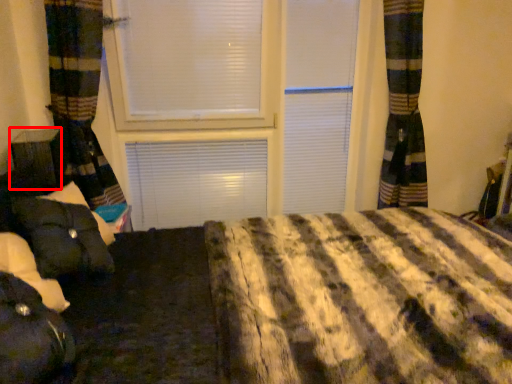
Question: Where is furniture (annotated by the red box) located in relation to bean bag chair in the image?

Choices:
 (A) left
 (B) right

Answer: (A)